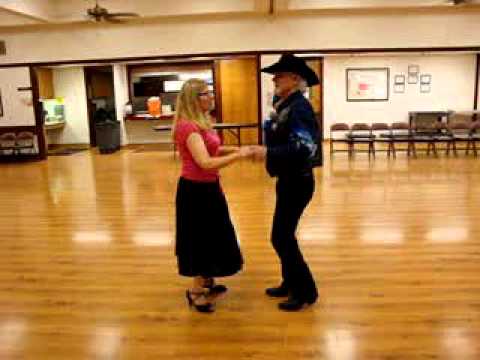
What are the coordinates of `leftmost chair` in the screenshot? It's located at (4, 140).